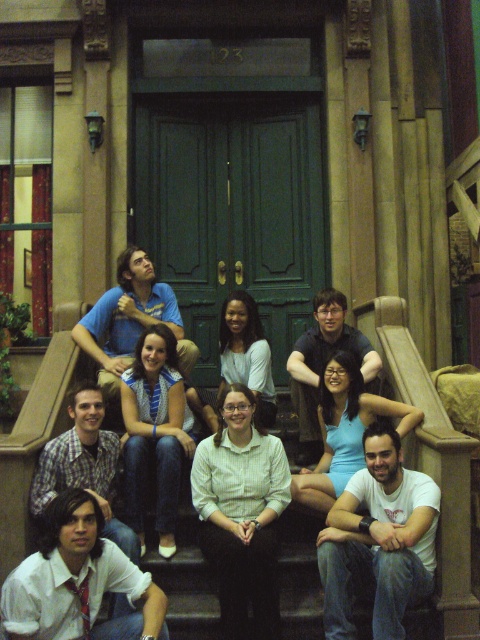
Is point (338, 625) positioned behind point (99, 561)?

Yes, point (338, 625) is farther from viewer.

Can you confirm if white cotton t-shirt at lower right is shorter than white shirt at center?

Incorrect, white cotton t-shirt at lower right's height does not fall short of white shirt at center's.

The height and width of the screenshot is (640, 480). Identify the location of white cotton t-shirt at lower right. (379, 540).

The image size is (480, 640). In order to click on white cotton t-shirt at lower right in this screenshot , I will do `click(379, 540)`.

Image resolution: width=480 pixels, height=640 pixels. What do you see at coordinates (155, 432) in the screenshot? I see `blue denim jeans at center` at bounding box center [155, 432].

Which is above, blue denim jeans at center or light blue fabric dress at center?

light blue fabric dress at center is above.

Find the location of a particular element. blue denim jeans at center is located at coordinates (155, 432).

Image resolution: width=480 pixels, height=640 pixels. What do you see at coordinates (240, 513) in the screenshot?
I see `white glossy shirt at center` at bounding box center [240, 513].

Between white glossy shirt at center and blue denim jeans at center, which one is positioned lower?

white glossy shirt at center

This screenshot has width=480, height=640. What are the coordinates of `white glossy shirt at center` in the screenshot? It's located at (240, 513).

Identify the location of white glossy shirt at center. (240, 513).